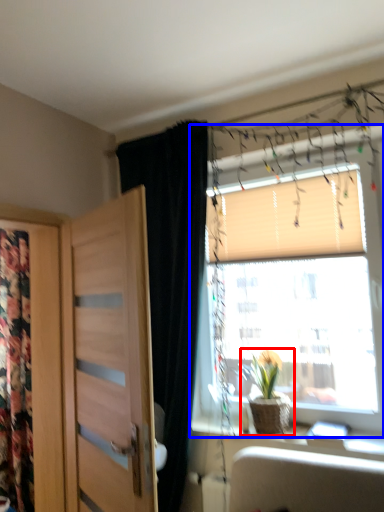
Question: Among these objects, which one is nearest to the camera, houseplant (highlighted by a red box) or window (highlighted by a blue box)?

Choices:
 (A) houseplant
 (B) window

Answer: (B)